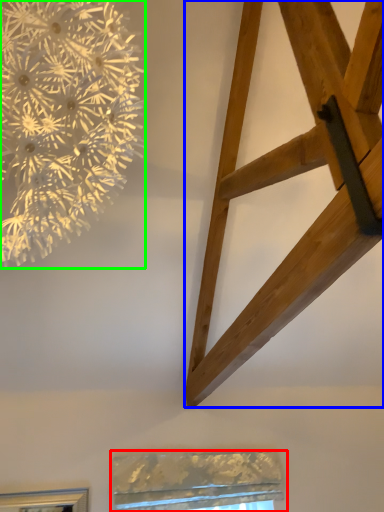
Question: Considering the real-world distances, which object is farthest from window (highlighted by a red box)? furniture (highlighted by a blue box) or flower (highlighted by a green box)?

Choices:
 (A) furniture
 (B) flower

Answer: (B)